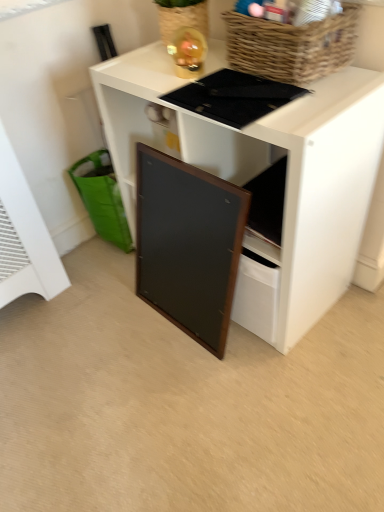
Identify the location of free region on the left part of black matte board at center. tap(87, 328).